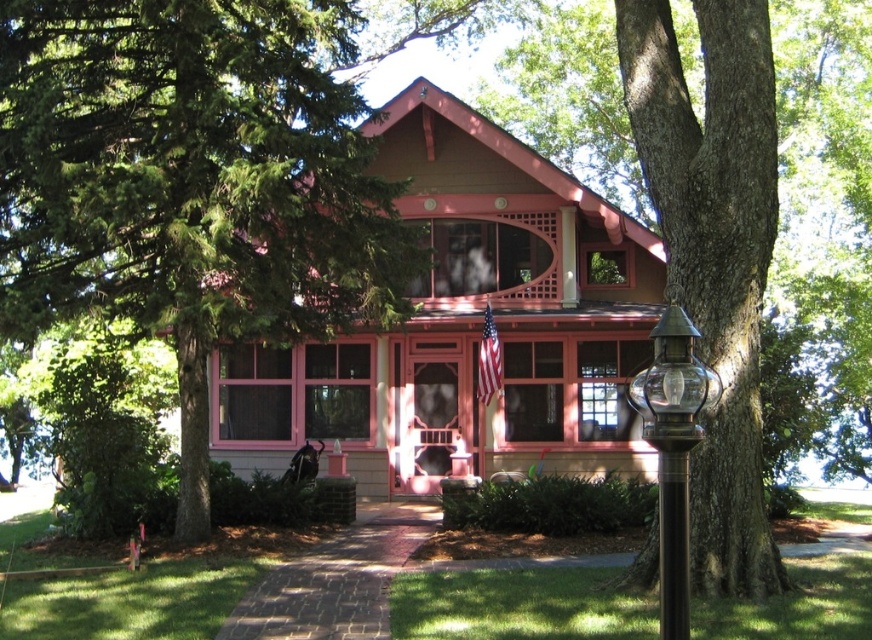
Question: Is green leafy tree at left wider than smooth brown tree trunk at right?

Choices:
 (A) no
 (B) yes

Answer: (B)

Question: Which point is closer to the camera?

Choices:
 (A) (691, 380)
 (B) (720, 38)

Answer: (A)

Question: Is smooth brown tree trunk at right to the right of bronze metallic lamp post at right from the viewer's perspective?

Choices:
 (A) yes
 (B) no

Answer: (A)

Question: Among these points, which one is nearest to the camera?

Choices:
 (A) (733, 356)
 (B) (196, 422)

Answer: (A)

Question: Does smooth brown tree trunk at right appear on the left side of bronze metallic lamp post at right?

Choices:
 (A) yes
 (B) no

Answer: (B)

Question: Which point is closer to the camera taking this photo?

Choices:
 (A) (741, 29)
 (B) (652, 420)
 (C) (52, 33)

Answer: (B)